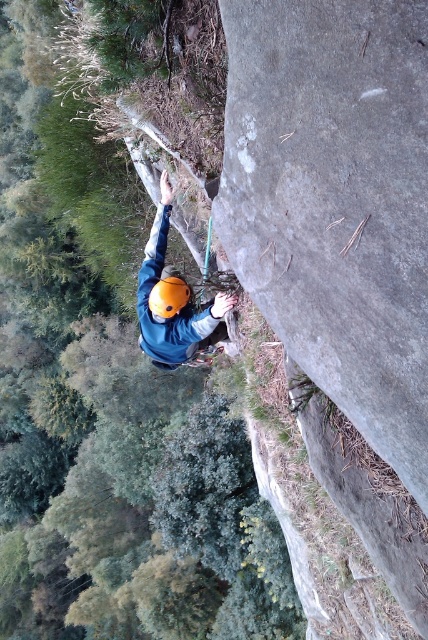
Is point (157, 252) in front of point (184, 301)?

No.

Measure the distance between point (142,276) and camera.

The distance of point (142,276) from camera is 6.07 meters.

Between point (208, 346) and point (163, 310), which one is positioned behind?

Positioned behind is point (208, 346).

Locate an element on the screen. The height and width of the screenshot is (640, 428). matte blue jacket at center is located at coordinates (174, 300).